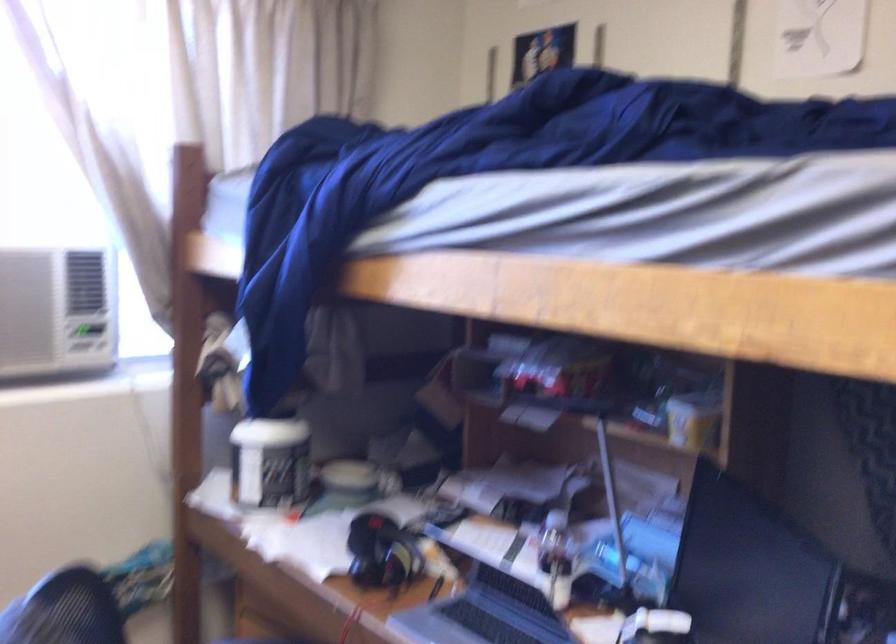
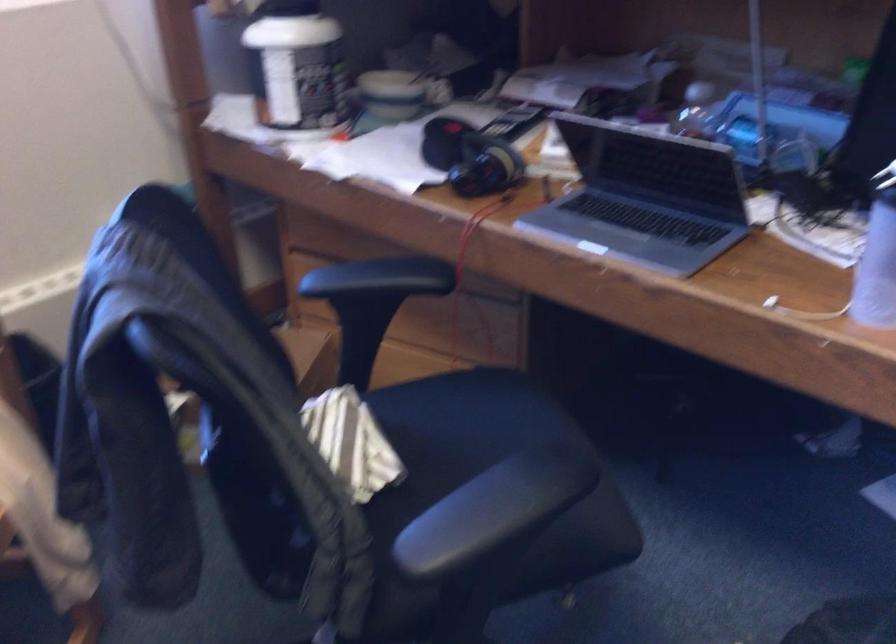
Question: Based on the continuous images, in which direction is the camera rotating? Reply with the corresponding letter.

Choices:
 (A) Left
 (B) Right
 (C) Up
 (D) Down

Answer: (D)